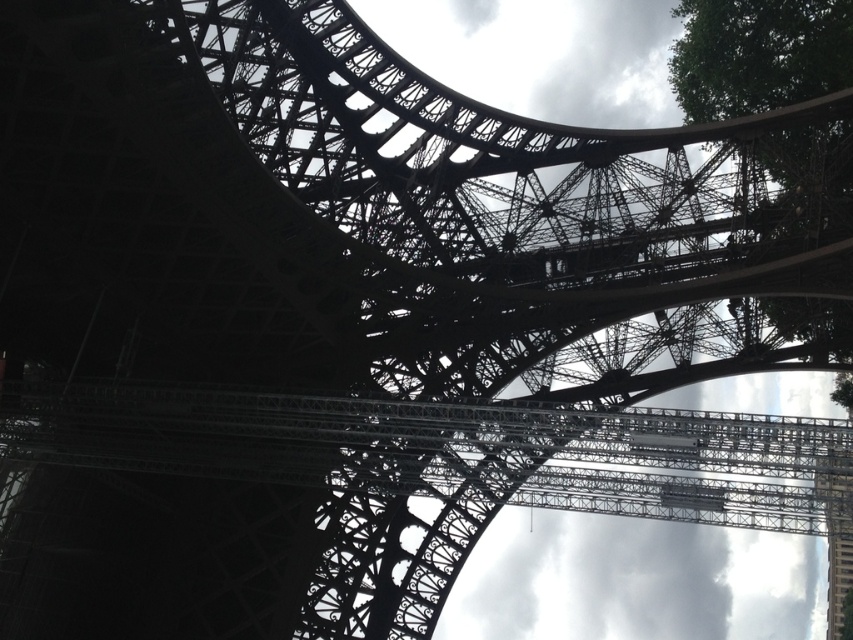
You are standing in front of the Eiffel Tower and notice a green leafy tree at upper right and a metallic lattice tower at right. Which object is closer to you?

The green leafy tree at upper right is closer to you because the metallic lattice tower at right is behind it.

In the scene shown: You are a photographer standing at the base of the metallic lattice tower at right. You want to capture a photo of the green leafy tree at upper right in the background. Given that your camera has a maximum zoom range of 100 feet, can you fit the tree into the frame without moving closer?

The green leafy tree at upper right is 126.88 feet from the metallic lattice tower at right. Since your camera can only zoom up to 100 feet, you cannot capture the tree in the frame without moving closer.